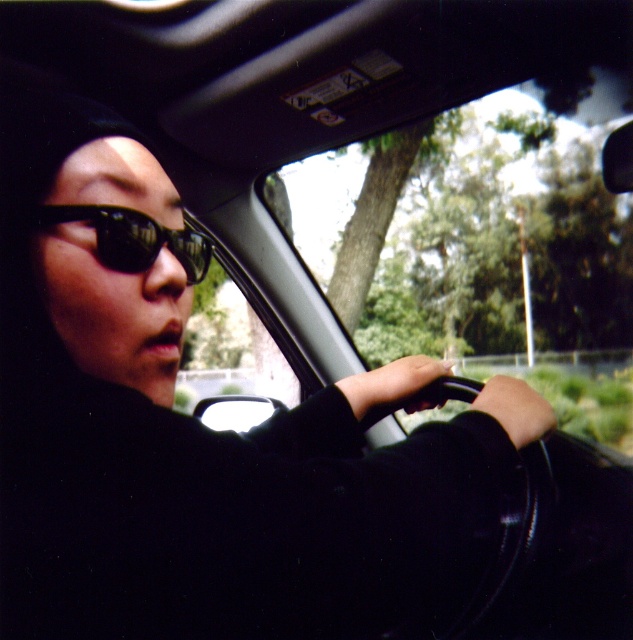
Is transparent glass car window at center above black reflective sunglasses at center?

Yes.

Based on the photo, is transparent glass car window at center to the left of black reflective sunglasses at center from the viewer's perspective?

No, transparent glass car window at center is not to the left of black reflective sunglasses at center.

What are the coordinates of `transparent glass car window at center` in the screenshot? It's located at (467, 232).